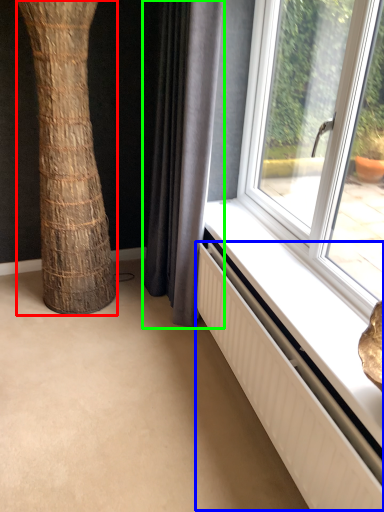
Question: Which is farther away from tree trunk (highlighted by a red box)? radiator (highlighted by a blue box) or curtain (highlighted by a green box)?

Choices:
 (A) radiator
 (B) curtain

Answer: (A)